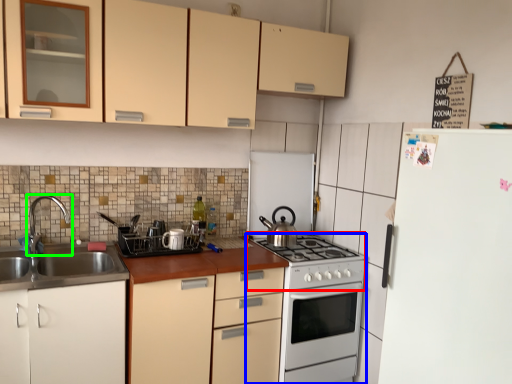
Question: Based on their relative distances, which object is nearer to gas stove (highlighted by a red box)? Choose from oven (highlighted by a blue box) and tap (highlighted by a green box).

Choices:
 (A) oven
 (B) tap

Answer: (A)